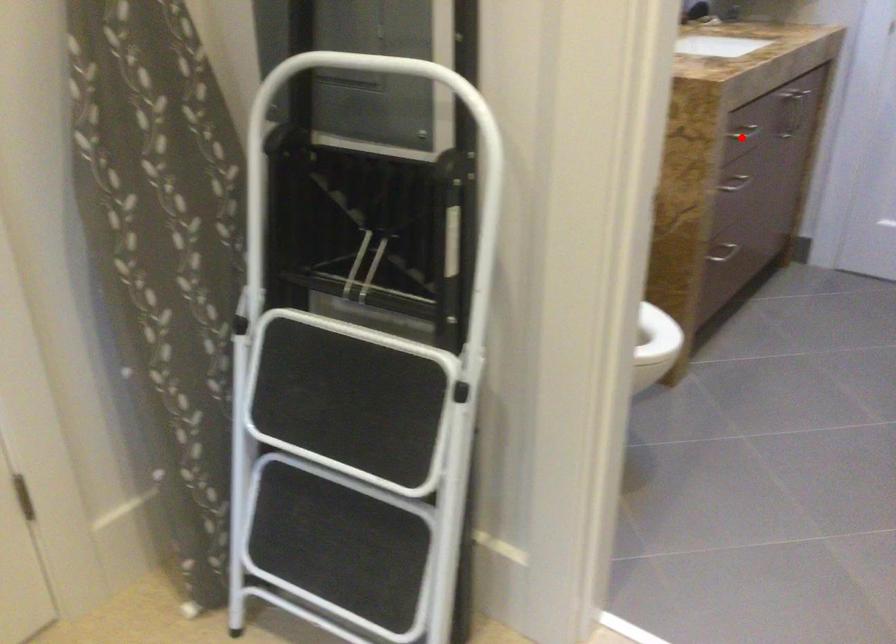
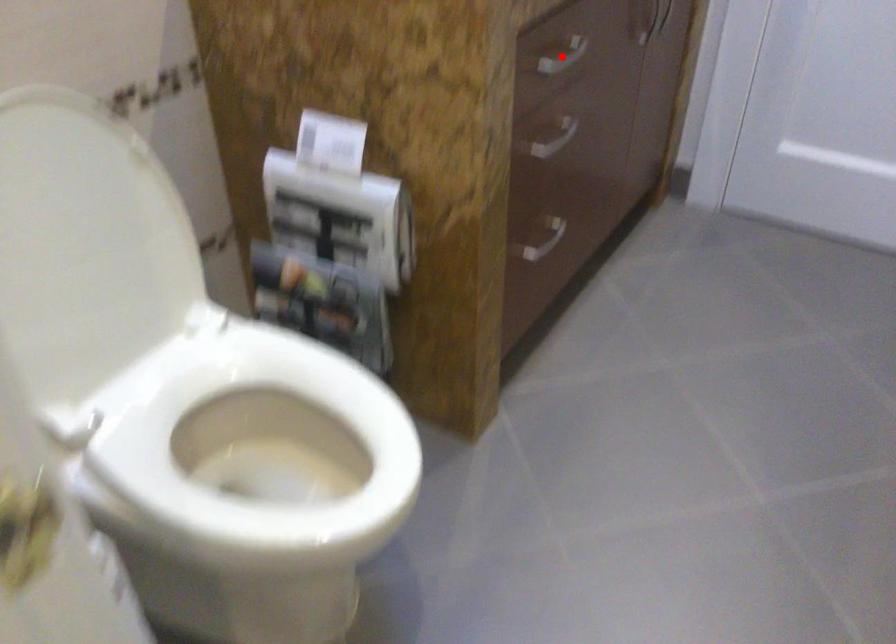
I am providing you with two images of the same scene from different viewpoints. A red point is marked on the first image and another point is marked on the second image. Is the marked point in image1 the same physical position as the marked point in image2?

Yes